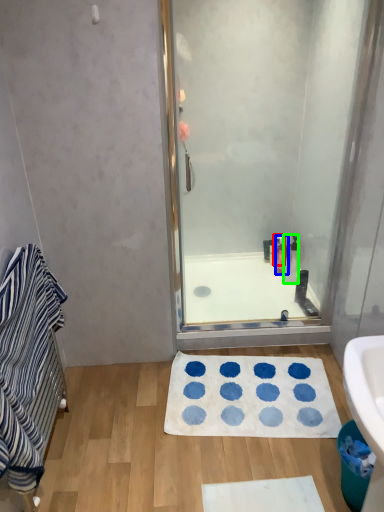
Question: Considering the real-world distances, which object is closest to toiletry (highlighted by a red box)? toiletry (highlighted by a blue box) or toiletry (highlighted by a green box).

Choices:
 (A) toiletry
 (B) toiletry

Answer: (A)